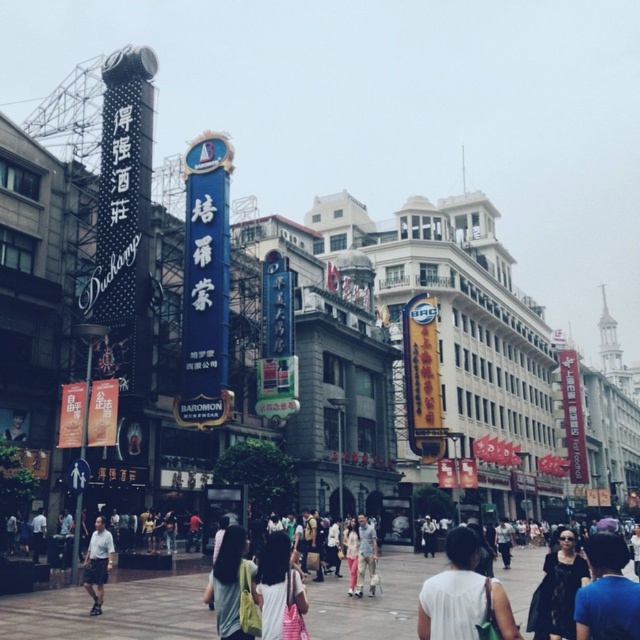
Question: Based on their relative distances, which object is farther from the light blue shirt at center?

Choices:
 (A) light gray pants at center
 (B) white fabric shirt at lower left

Answer: (A)

Question: Is light blue shirt at center wider than white fabric shirt at lower left?

Choices:
 (A) no
 (B) yes

Answer: (B)

Question: Among these objects, which one is nearest to the camera?

Choices:
 (A) light gray pants at center
 (B) black fabric dress at center
 (C) light blue shirt at center

Answer: (B)

Question: Is light brown fabric bag at center smaller than white cotton dress at center?

Choices:
 (A) yes
 (B) no

Answer: (A)

Question: Is light brown fabric bag at center closer to camera compared to black fabric dress at center?

Choices:
 (A) no
 (B) yes

Answer: (A)

Question: Estimate the real-world distances between objects in this image. Which object is farther from the light brown fabric bag at center?

Choices:
 (A) white fabric shirt at lower left
 (B) dark blue shirt at lower right
 (C) white cotton dress at center
 (D) light blue shirt at center

Answer: (A)